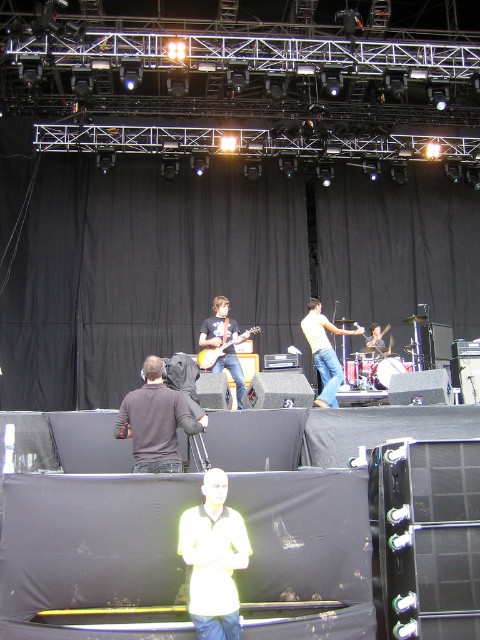
Is white matte shirt at center further to camera compared to glossy wood guitar at center?

No, it is in front of glossy wood guitar at center.

Can you confirm if white matte shirt at center is positioned to the right of glossy wood guitar at center?

Indeed, white matte shirt at center is positioned on the right side of glossy wood guitar at center.

I want to click on white matte shirt at center, so click(214, 560).

The image size is (480, 640). In order to click on white matte shirt at center in this screenshot , I will do `click(214, 560)`.

Describe the element at coordinates (324, 352) in the screenshot. I see `light yellow shirt at center` at that location.

Is point (342, 371) less distant than point (207, 353)?

No, it is not.

Find the location of a particular element. The width and height of the screenshot is (480, 640). light yellow shirt at center is located at coordinates (324, 352).

Between dark gray fabric at center and light yellow shirt at center, which one appears on the left side from the viewer's perspective?

From the viewer's perspective, dark gray fabric at center appears more on the left side.

Which of these two, dark gray fabric at center or light yellow shirt at center, stands shorter?

With less height is dark gray fabric at center.

Who is more forward, (190,429) or (330,346)?

Positioned in front is point (190,429).

Find the location of `dark gray fabric at center`. dark gray fabric at center is located at coordinates (156, 420).